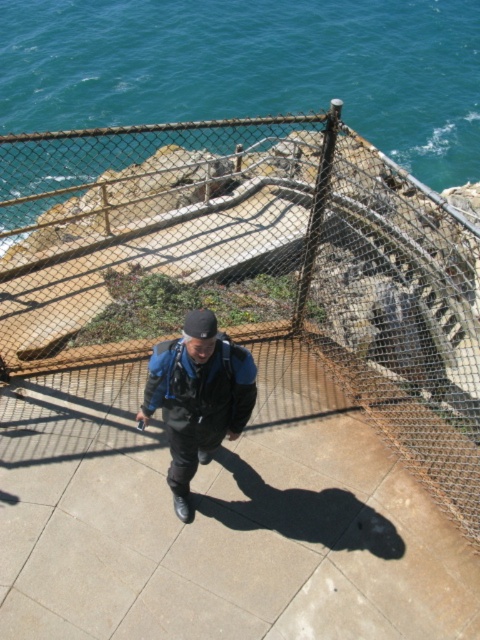
You are standing on the concrete platform and want to take a photo of the teal water at upper left. Which direction should you face to capture it in your camera?

The teal water at upper left is located at point (252, 68), so you should face towards the upper left direction to capture it in your camera.